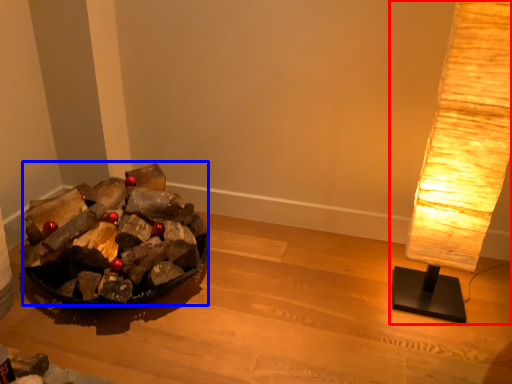
Question: Which object is further to the camera taking this photo, lamp (highlighted by a red box) or debris (highlighted by a blue box)?

Choices:
 (A) lamp
 (B) debris

Answer: (B)